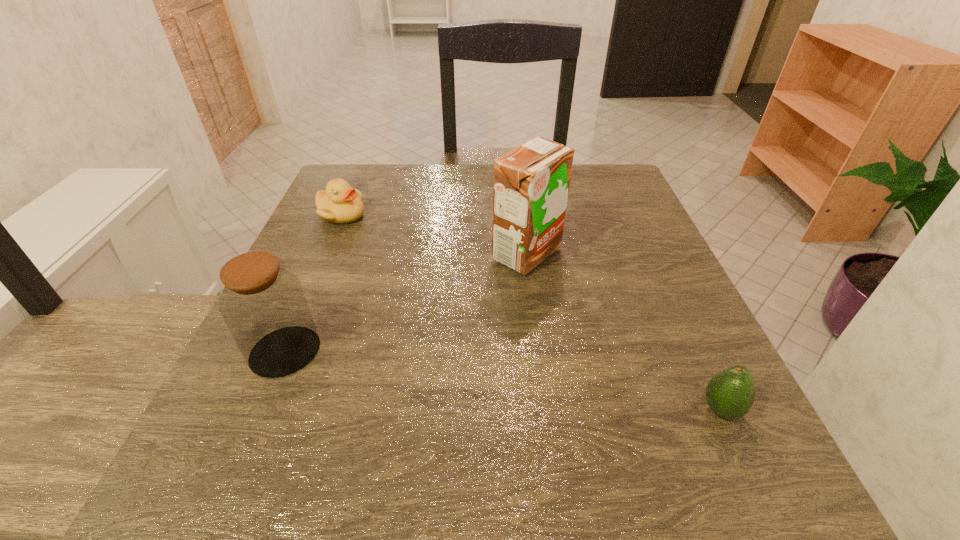
Image resolution: width=960 pixels, height=540 pixels. I want to click on vacant space at the left edge, so click(378, 214).

Where is `blank space at the right edge of the desktop`? The height and width of the screenshot is (540, 960). blank space at the right edge of the desktop is located at coordinates (621, 283).

Locate an element on the screen. This screenshot has width=960, height=540. vacant space at the far left corner of the desktop is located at coordinates (345, 180).

The image size is (960, 540). Find the location of `blank space at the far right corner`. blank space at the far right corner is located at coordinates (614, 175).

Locate an element on the screen. This screenshot has height=540, width=960. vacant space at the near right corner of the desktop is located at coordinates (680, 469).

Locate an element on the screen. vacant area that lies between the third nearest object and the farthest object is located at coordinates (434, 234).

Image resolution: width=960 pixels, height=540 pixels. I want to click on vacant region between the farthest object and the second farthest object, so click(x=434, y=234).

You are a GUI agent. You are given a task and a screenshot of the screen. Output one action in this format:
    pyautogui.click(x=<x>, y=<y>)
    Task: Click on the vacant area that lies between the farthest object and the avocado
    This screenshot has height=540, width=960.
    Given the screenshot: What is the action you would take?
    point(531,312)

At what (x,y) coordinates should I click in order to perform the action: click on free area in between the nearest object and the third object from left to right. Please return your answer as a coordinate pair (x, y). The height and width of the screenshot is (540, 960). Looking at the image, I should click on (624, 332).

At what (x,y) coordinates should I click in order to perform the action: click on vacant space in between the jar and the carton. Please return your answer as a coordinate pair (x, y). This screenshot has width=960, height=540. Looking at the image, I should click on (406, 303).